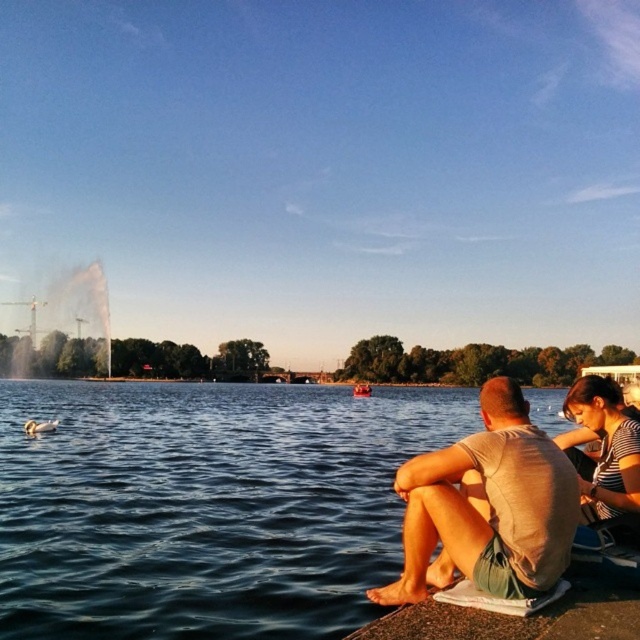
Does blue water at lower left appear on the left side of light gray cotton t-shirt at lower right?

Indeed, blue water at lower left is positioned on the left side of light gray cotton t-shirt at lower right.

Where is `blue water at lower left`? Image resolution: width=640 pixels, height=640 pixels. blue water at lower left is located at coordinates (205, 506).

Is blue water at lower left above wooden boat at center?

Correct, blue water at lower left is located above wooden boat at center.

Between point (128, 417) and point (365, 388), which one is positioned in front?

Point (128, 417) is in front.

Is point (314, 458) closer to viewer compared to point (356, 394)?

Yes, it is in front of point (356, 394).

I want to click on blue water at lower left, so click(x=205, y=506).

Is light gray cotton t-shirt at lower right smaller than wooden boat at center?

Correct, light gray cotton t-shirt at lower right occupies less space than wooden boat at center.

Who is shorter, light gray cotton t-shirt at lower right or wooden boat at center?

light gray cotton t-shirt at lower right is shorter.

What do you see at coordinates (486, 508) in the screenshot? I see `light gray cotton t-shirt at lower right` at bounding box center [486, 508].

Find the location of a particular element. The image size is (640, 640). light gray cotton t-shirt at lower right is located at coordinates (486, 508).